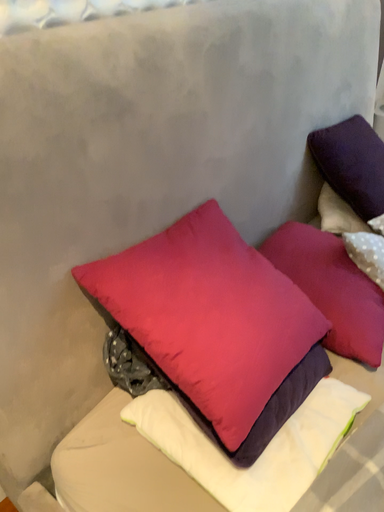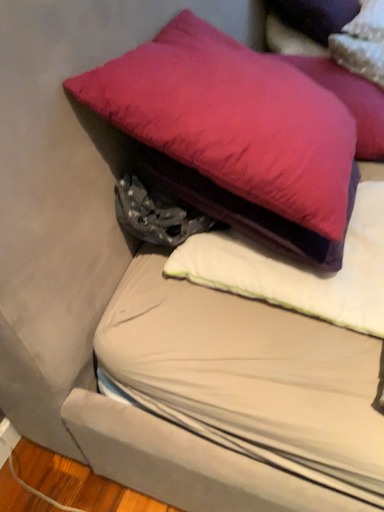
Question: How did the camera likely rotate when shooting the video?

Choices:
 (A) rotated upward
 (B) rotated downward

Answer: (B)